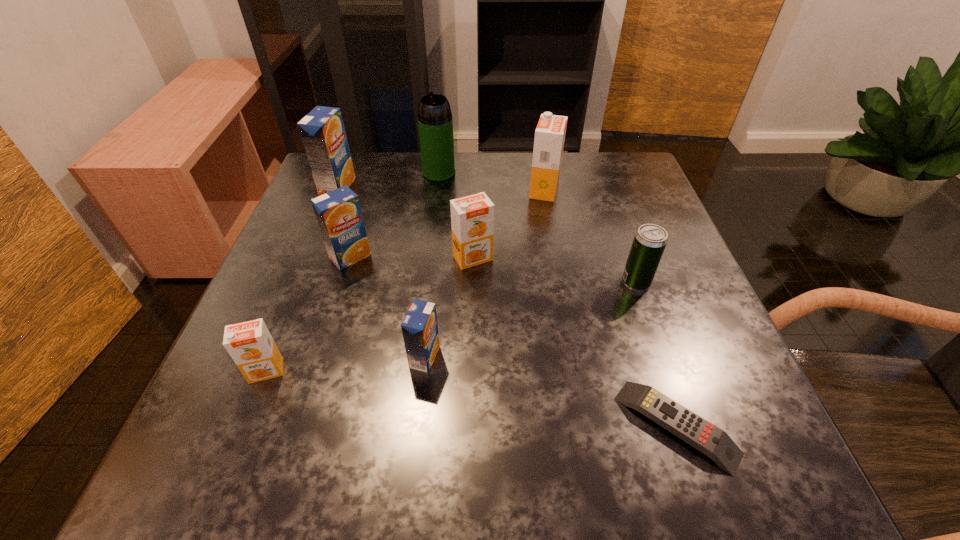
In order to click on the tallest object in this screenshot , I will do `click(435, 122)`.

At what (x,y) coordinates should I click in order to perform the action: click on thermos bottle. Please return your answer as a coordinate pair (x, y). Looking at the image, I should click on (435, 122).

At what (x,y) coordinates should I click in order to perform the action: click on the biggest blue orange_juice. Please return your answer as a coordinate pair (x, y). Looking at the image, I should click on (322, 131).

Find the location of a particular element. The height and width of the screenshot is (540, 960). the farthest blue orange_juice is located at coordinates coord(322,131).

Where is `the biggest orange orange juice`? This screenshot has width=960, height=540. the biggest orange orange juice is located at coordinates (550, 132).

Where is `the rightmost orange juice`? the rightmost orange juice is located at coordinates (550, 132).

Image resolution: width=960 pixels, height=540 pixels. I want to click on the third orange juice from left to right, so click(x=338, y=213).

What are the coordinates of `the second blue orange_juice from right to left` in the screenshot? It's located at (338, 213).

Where is `the fifth orange juice from left to right`? the fifth orange juice from left to right is located at coordinates (472, 217).

The width and height of the screenshot is (960, 540). I want to click on the second farthest orange orange juice, so tap(472, 217).